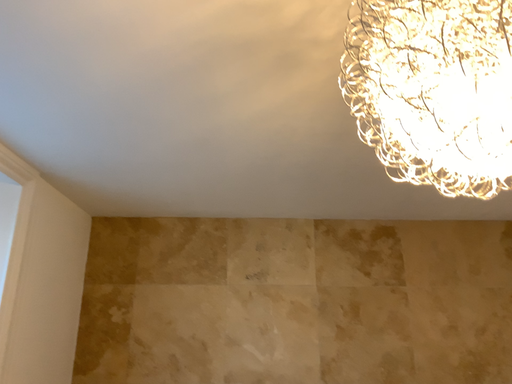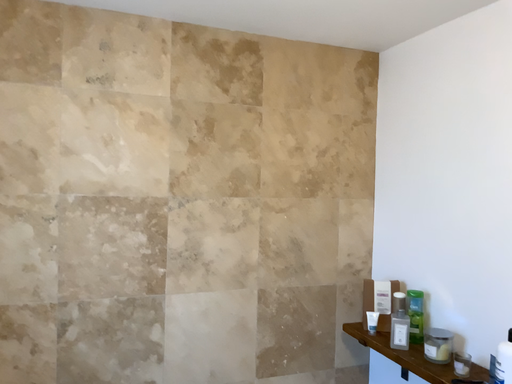
Question: How did the camera likely rotate when shooting the video?

Choices:
 (A) rotated upward
 (B) rotated downward

Answer: (B)